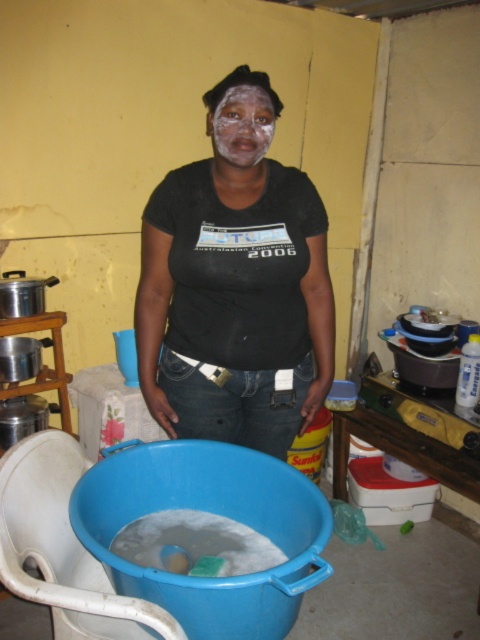
You are a photographer standing 1.30 meters away from the matte black shirt at center. You want to take a photo of the shirt while ensuring the camera is close enough to capture details clearly. Is the current distance sufficient for a clear photo?

The matte black shirt at center and camera are 1.30 meters apart from each other, so yes, the current distance of 1.30 meters is sufficient for the photographer to capture clear details of the matte black shirt at center.

The woman is wearing a matte black shirt at center and has a white matte face at center. Which of these two items has a larger height?

The matte black shirt at center has a greater height compared to the white matte face at center.

You are a photographer trying to capture a closeup of the woman in the scene. Since the matte black shirt at center and the white matte face at center are both in focus, which one will appear bigger in the photo?

The matte black shirt at center will appear bigger in the photo because it has a larger size compared to the white matte face at center.